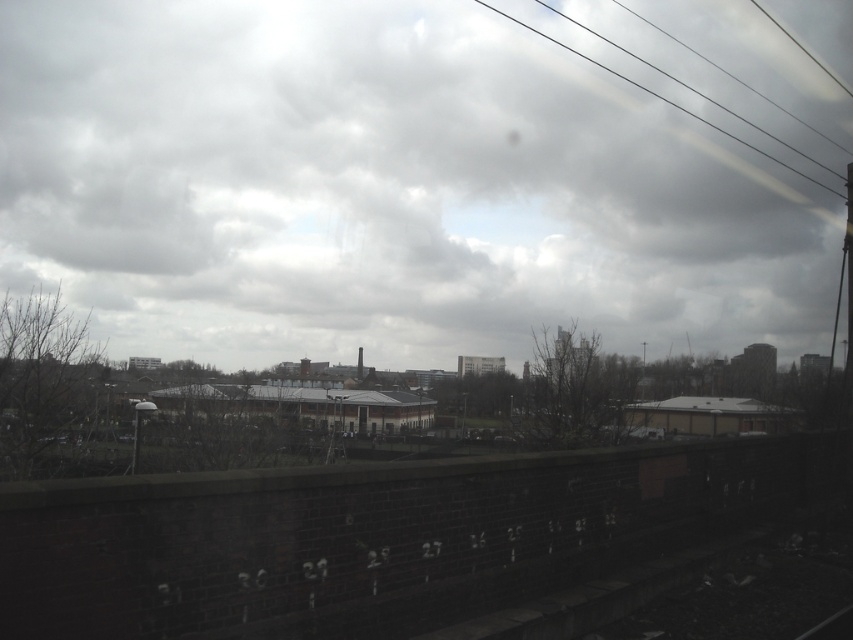
You are a photographer trying to capture the cloudy sky at upper center and the smooth wire at upper right in your shot. Which object occupies a larger portion of the frame horizontally?

The cloudy sky at upper center occupies a larger portion of the frame horizontally since its width surpasses that of the smooth wire at upper right.

What is the exact coordinate of the cloudy sky at upper center in the image?

The cloudy sky at upper center is located at point coordinates [381,189].